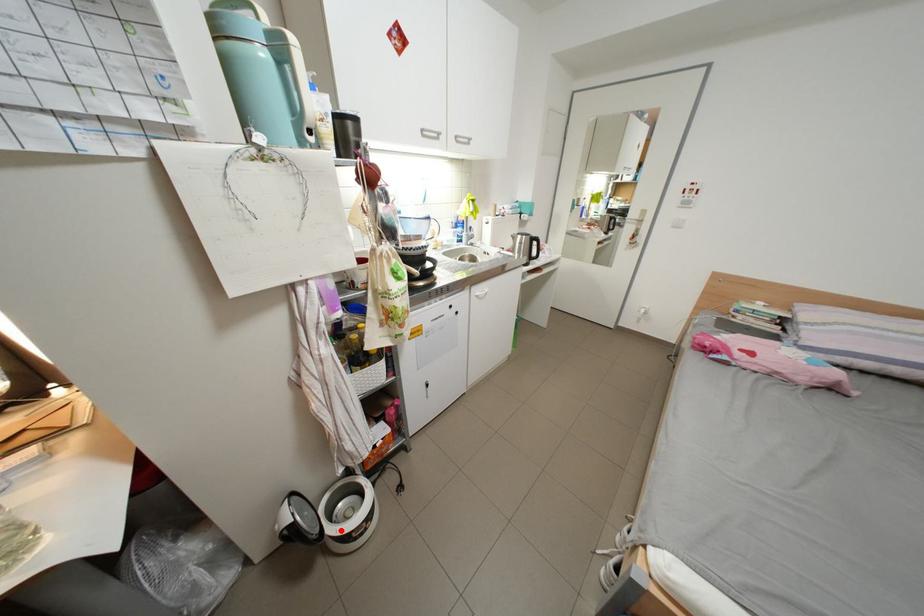
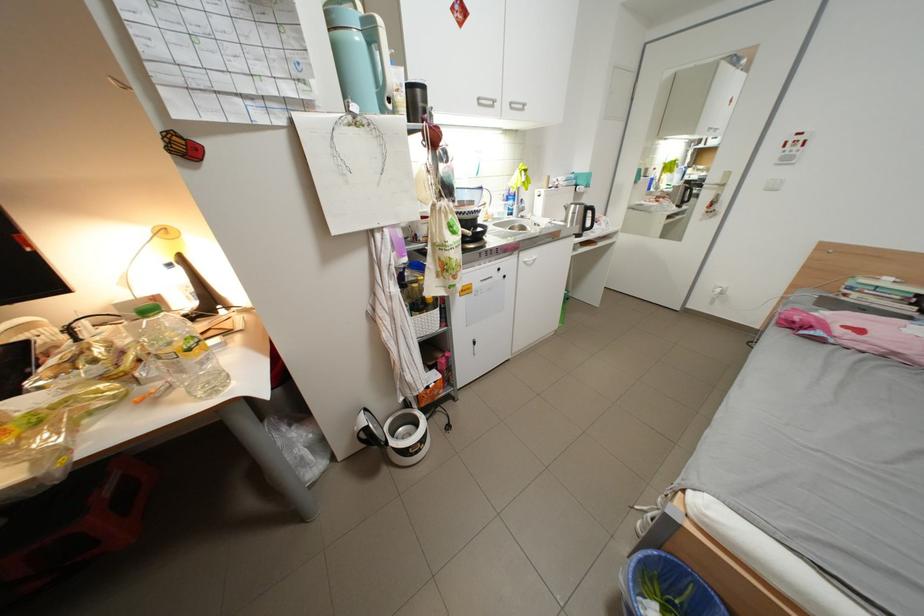
Question: I am providing you with two images of the same scene from different viewpoints. Image1 has a red point marked. In image2, the corresponding 3D location appears at what relative position? Reply with the corresponding letter.

Choices:
 (A) Closer
 (B) Farther

Answer: (B)